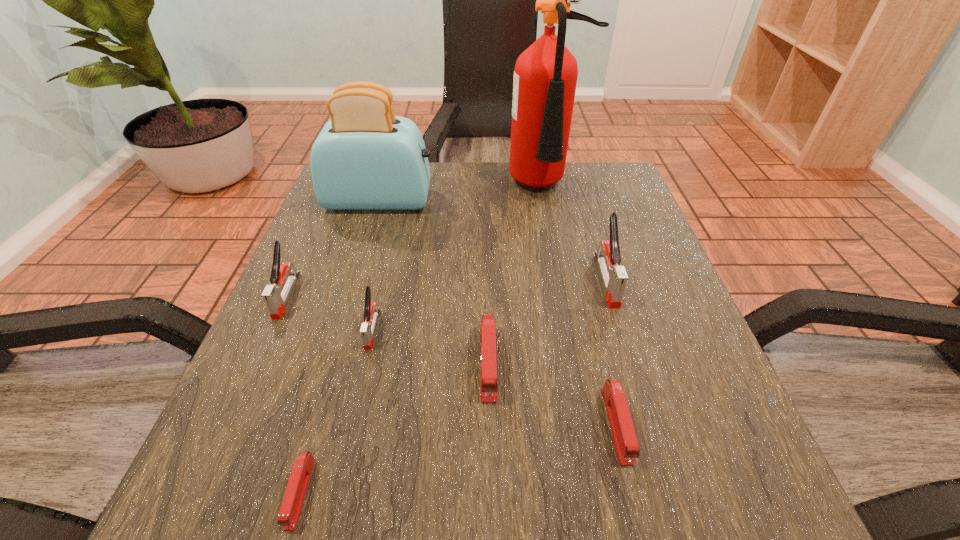
Find the location of a particular element. The height and width of the screenshot is (540, 960). object that is at the far right corner is located at coordinates tap(545, 75).

Locate an element on the screen. The image size is (960, 540). free spot at the far edge of the desktop is located at coordinates (510, 194).

In the image, there is a desktop. Where is `free region at the near edge`? This screenshot has width=960, height=540. free region at the near edge is located at coordinates (517, 469).

The image size is (960, 540). In order to click on free space at the left edge of the desktop in this screenshot , I will do `click(356, 280)`.

Locate an element on the screen. The width and height of the screenshot is (960, 540). free space at the right edge of the desktop is located at coordinates (679, 339).

Find the location of `vacant space at the far right corner of the desktop`. vacant space at the far right corner of the desktop is located at coordinates (573, 181).

The image size is (960, 540). I want to click on blank region between the tallest object and the rightmost gray stapler, so click(577, 233).

I want to click on blank region between the second shortest object and the second biggest gray stapler, so click(x=452, y=360).

This screenshot has width=960, height=540. Identify the location of free point between the fifth shortest object and the third tallest stapler. (329, 312).

Where is `vacant area that lies between the second tallest object and the third stapler from right to left`? The width and height of the screenshot is (960, 540). vacant area that lies between the second tallest object and the third stapler from right to left is located at coordinates (434, 281).